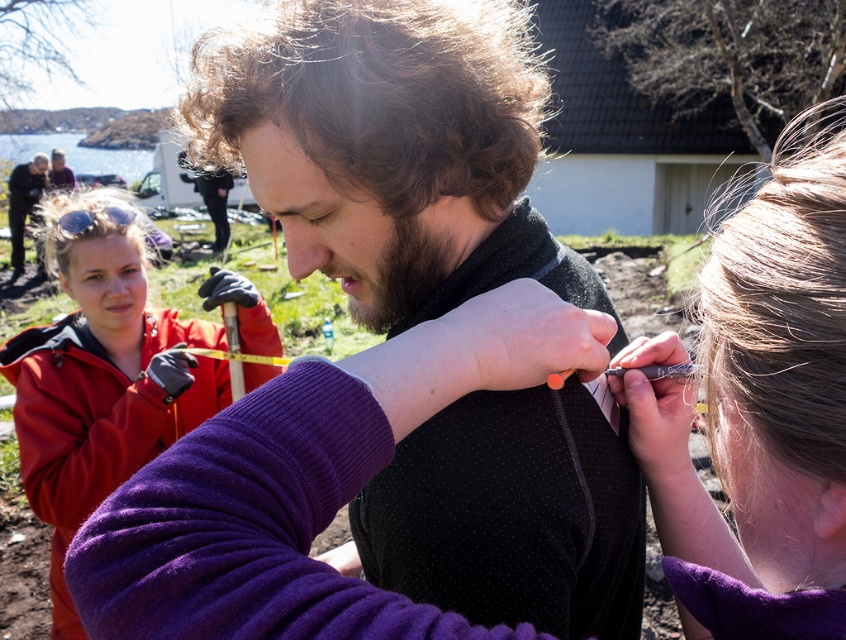
Is point (515, 176) positioned before point (437, 236)?

No, it is not.

Is brown curly hair at center to the right of brown matte ponytail at center from the viewer's perspective?

Correct, you'll find brown curly hair at center to the right of brown matte ponytail at center.

What are the coordinates of `brown curly hair at center` in the screenshot? It's located at (382, 97).

This screenshot has width=846, height=640. In order to click on brown curly hair at center in this screenshot , I will do `click(382, 97)`.

Between dark gray jacket at upper left and yellow rubber tape at center, which one has more height?

dark gray jacket at upper left is taller.

Where is `dark gray jacket at upper left`? Image resolution: width=846 pixels, height=640 pixels. dark gray jacket at upper left is located at coordinates (23, 204).

The height and width of the screenshot is (640, 846). I want to click on dark gray jacket at upper left, so click(x=23, y=204).

Does black textured sweater at center appear on the right side of purple fabric hair at upper right?

Incorrect, black textured sweater at center is not on the right side of purple fabric hair at upper right.

Which is more to the right, black textured sweater at center or purple fabric hair at upper right?

From the viewer's perspective, purple fabric hair at upper right appears more on the right side.

Find the location of a particular element. This screenshot has height=640, width=846. black textured sweater at center is located at coordinates (389, 140).